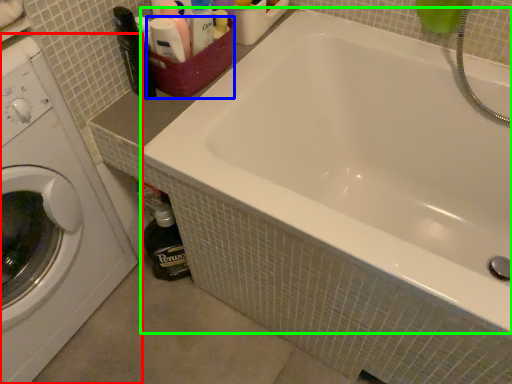
Question: Based on their relative distances, which object is farther from washing machine (highlighted by a red box)? Choose from basket (highlighted by a blue box) and bathtub (highlighted by a green box).

Choices:
 (A) basket
 (B) bathtub

Answer: (B)